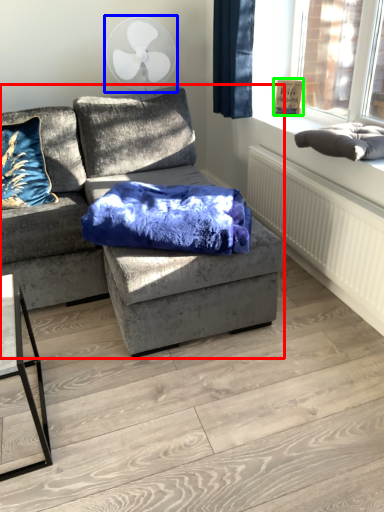
Question: Which object is positioned farthest from studio couch (highlighted by a red box)? Select from mechanical fan (highlighted by a blue box) and picture frame (highlighted by a green box).

Choices:
 (A) mechanical fan
 (B) picture frame

Answer: (B)